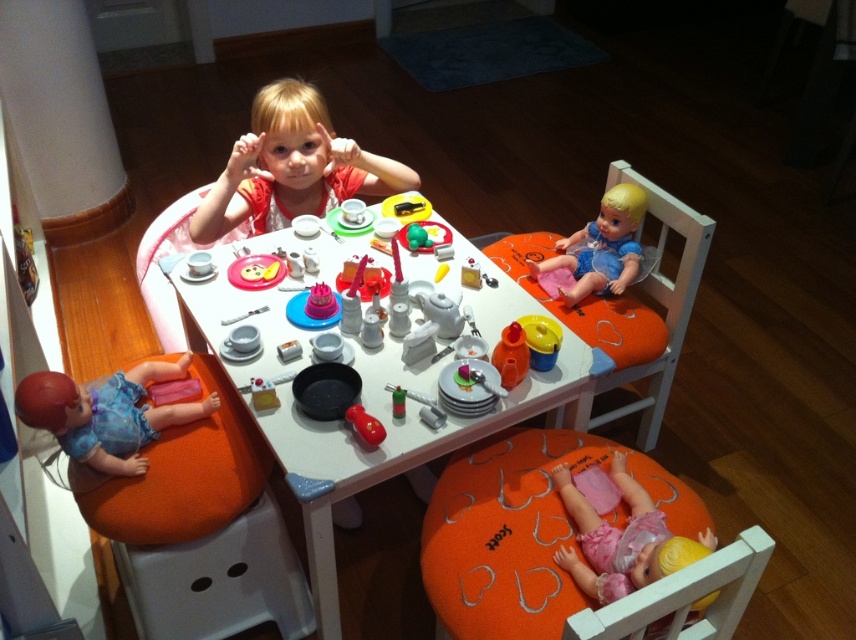
Who is taller, white wood chair at upper right or pink fabric doll at lower right?

white wood chair at upper right

Is white wood chair at upper right closer to the viewer compared to pink fabric doll at lower right?

No, it is not.

Where is `white wood chair at upper right`? This screenshot has height=640, width=856. white wood chair at upper right is located at coordinates (629, 304).

At what (x,y) coordinates should I click in order to perform the action: click on white wood chair at upper right. Please return your answer as a coordinate pair (x, y). The image size is (856, 640). Looking at the image, I should click on (629, 304).

Who is lower down, white wood chair at upper right or matte plastic plate at center?

white wood chair at upper right

Can you confirm if white wood chair at upper right is smaller than matte plastic plate at center?

No.

Identify the location of white wood chair at upper right. (x=629, y=304).

I want to click on white wood chair at upper right, so click(629, 304).

Does white wood chair at upper right have a smaller size compared to metallic silver fork at upper center?

No.

Which is in front, point (649, 362) or point (265, 390)?

Point (265, 390) is in front.

What do you see at coordinates (629, 304) in the screenshot?
I see `white wood chair at upper right` at bounding box center [629, 304].

This screenshot has height=640, width=856. In order to click on white wood chair at upper right in this screenshot , I will do `click(629, 304)`.